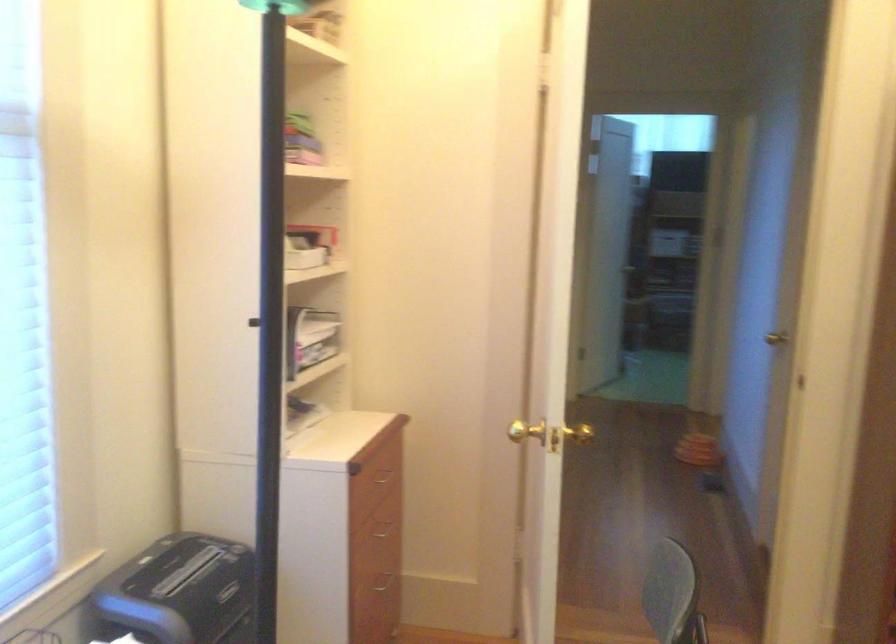
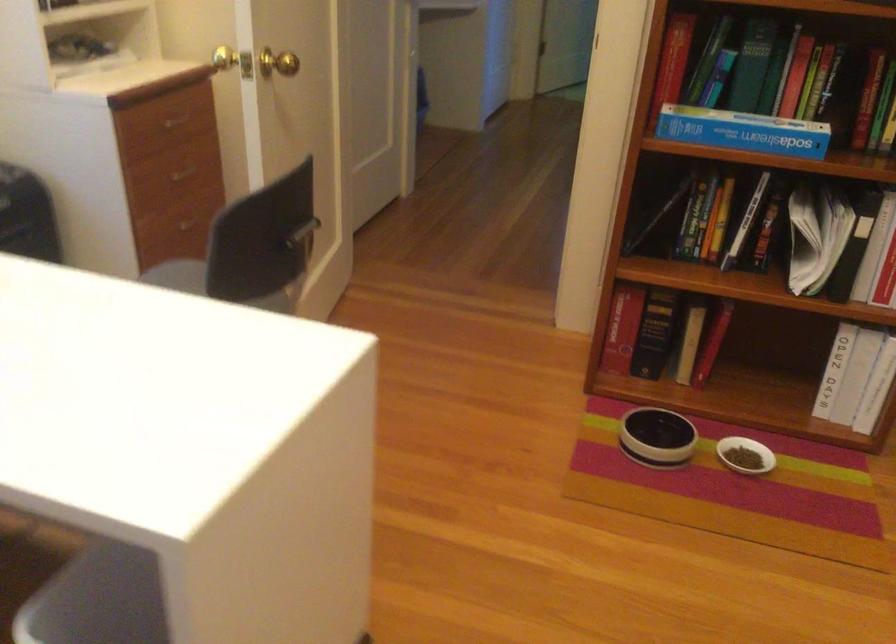
Question: The first image is from the beginning of the video and the second image is from the end. How did the camera likely rotate when shooting the video?

Choices:
 (A) Left
 (B) Right
 (C) Up
 (D) Down

Answer: (D)